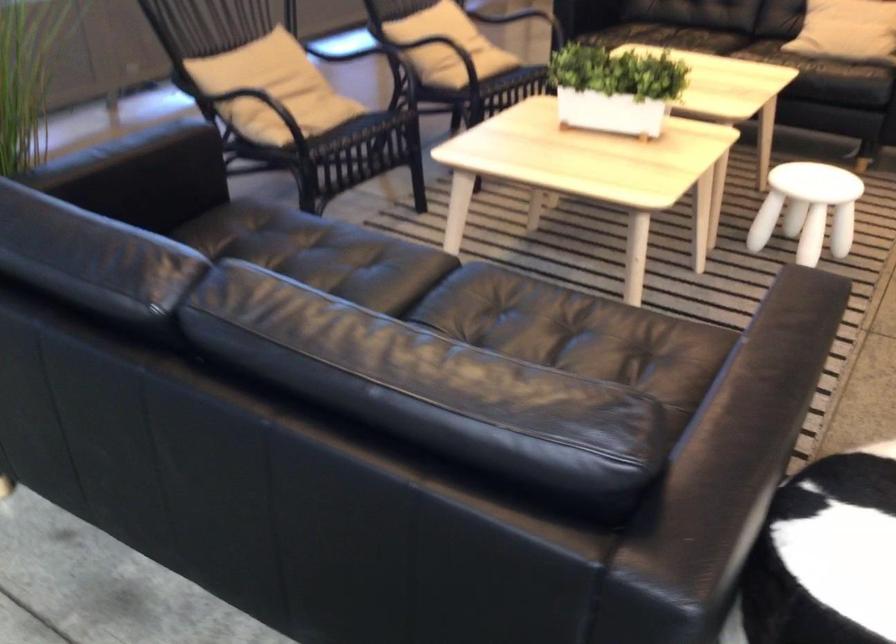
Locate an element on the screen. white planter box is located at coordinates point(615,88).